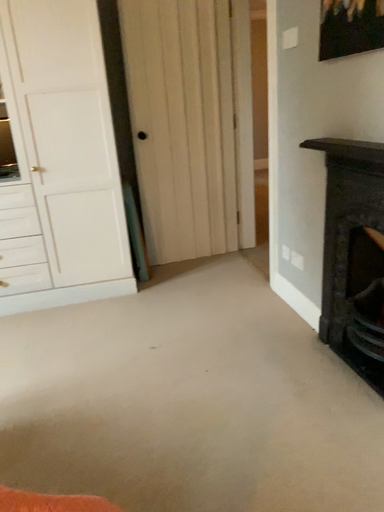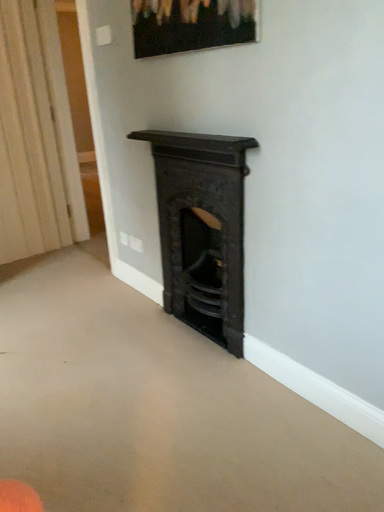
Question: Which way did the camera rotate in the video?

Choices:
 (A) rotated right
 (B) rotated left

Answer: (A)